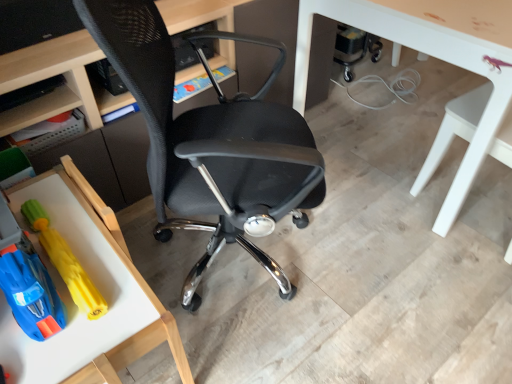
At what (x,y) coordinates should I click in order to perform the action: click on vacant area that lies to the right of yellow rubber toy at lower left, the 1th toy from the right. Please return your answer as a coordinate pair (x, y). This screenshot has width=512, height=384. Looking at the image, I should click on (109, 259).